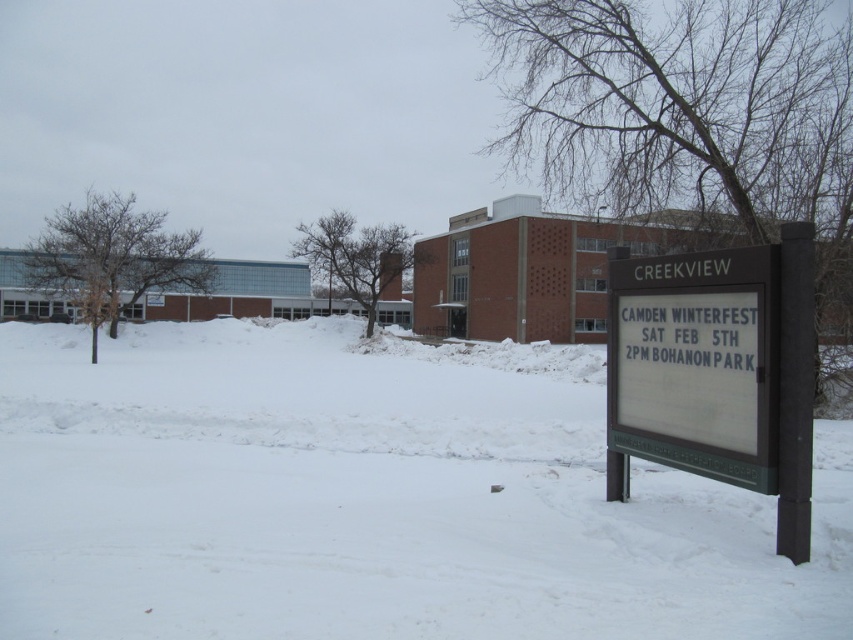
You are standing at the point marked by the coordinates point (369,499) in the snowy scene. What is the terrain like at your current location?

The terrain at point (369,499) is covered with white powdery snow at center.